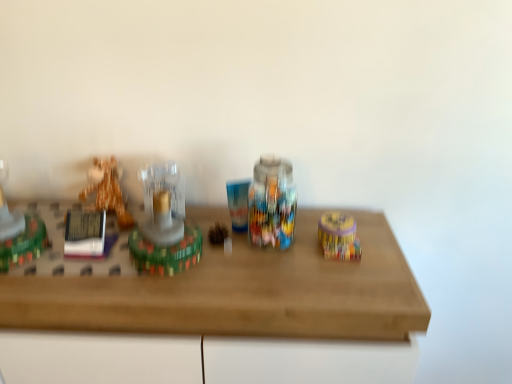
Image resolution: width=512 pixels, height=384 pixels. I want to click on unoccupied area behind shiny green plastic toy at left, which appears as the 4th toy when viewed from the right, so click(48, 211).